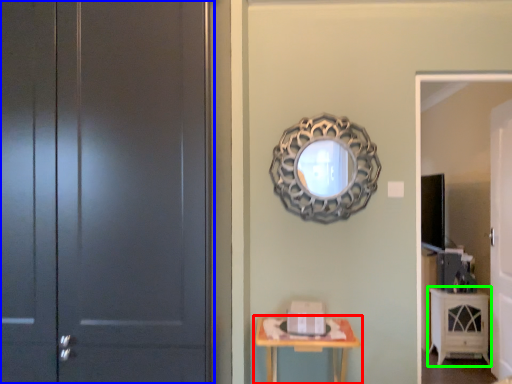
Question: Estimate the real-world distances between objects in this image. Which object is farther from table (highlighted by a red box), door (highlighted by a blue box) or cabinetry (highlighted by a green box)?

Choices:
 (A) door
 (B) cabinetry

Answer: (B)